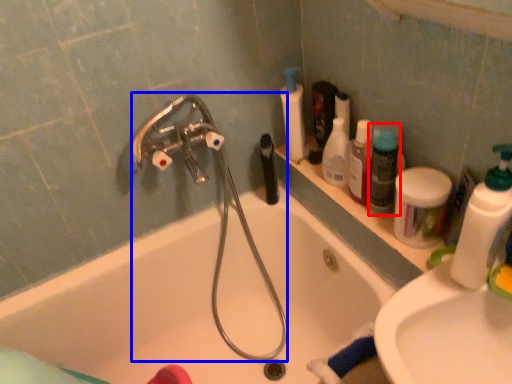
Question: Which object appears closest to the camera in this image, cleaning product (highlighted by a red box) or garden hose (highlighted by a blue box)?

Choices:
 (A) cleaning product
 (B) garden hose

Answer: (B)